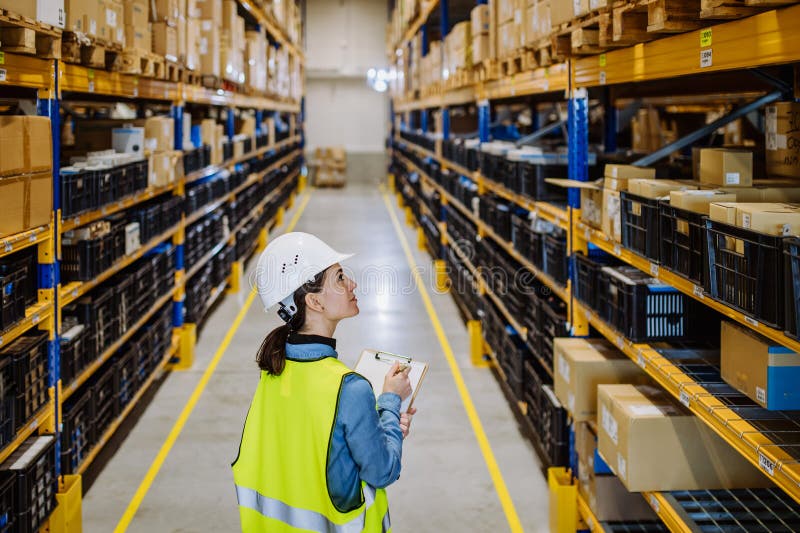
Locate an element on the screen. This screenshot has height=533, width=800. yellow line on warehouse floor is located at coordinates (509, 520), (465, 397), (408, 252), (393, 204), (308, 199), (250, 301), (206, 375), (166, 451), (129, 510).